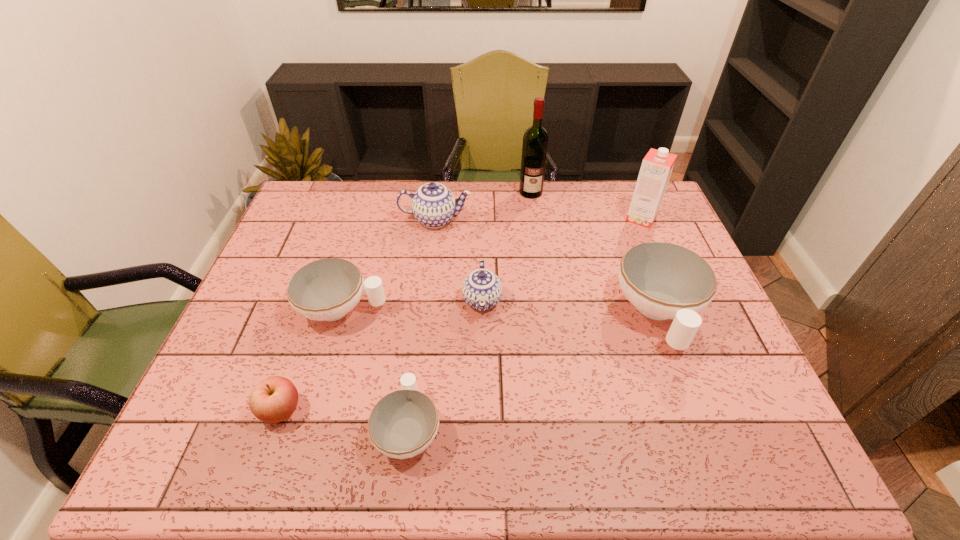
I want to click on the tallest object, so click(535, 140).

The height and width of the screenshot is (540, 960). Find the location of `the third object from right to left`. the third object from right to left is located at coordinates pyautogui.click(x=535, y=140).

Where is `the seventh shortest object`? The width and height of the screenshot is (960, 540). the seventh shortest object is located at coordinates (657, 165).

Locate an element on the screen. This screenshot has height=540, width=960. the bigger blue chinaware is located at coordinates (433, 205).

Where is `the farthest chinaware`? the farthest chinaware is located at coordinates (433, 205).

The image size is (960, 540). I want to click on the rightmost white chinaware, so click(662, 280).

Locate an element on the screen. The image size is (960, 540). the rightmost chinaware is located at coordinates (662, 280).

Locate an element on the screen. The height and width of the screenshot is (540, 960). the nearer blue chinaware is located at coordinates (482, 289).

At what (x,y) coordinates should I click in order to perform the action: click on the leftmost white chinaware. Please return your answer as a coordinate pair (x, y). Looking at the image, I should click on [x=327, y=289].

Locate an element on the screen. This screenshot has width=960, height=540. apple is located at coordinates (273, 400).